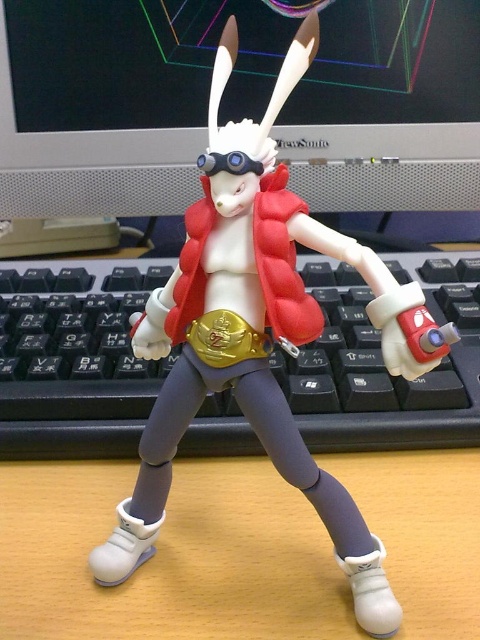
Question: Based on their relative distances, which object is nearer to the black plastic keyboard at center?

Choices:
 (A) blue matte goggles at center
 (B) matte black monitor at upper center

Answer: (B)

Question: Is black plastic keyboard at center above blue matte goggles at center?

Choices:
 (A) no
 (B) yes

Answer: (A)

Question: Which is nearer to the matte black monitor at upper center?

Choices:
 (A) blue matte goggles at center
 (B) black plastic keyboard at center

Answer: (B)

Question: Does matte black monitor at upper center appear on the left side of blue matte goggles at center?

Choices:
 (A) yes
 (B) no

Answer: (A)

Question: Which of the following is the closest to the observer?

Choices:
 (A) (405, 410)
 (B) (219, 161)

Answer: (B)

Question: In this image, where is matte black monitor at upper center located relative to black plastic keyboard at center?

Choices:
 (A) above
 (B) below

Answer: (A)